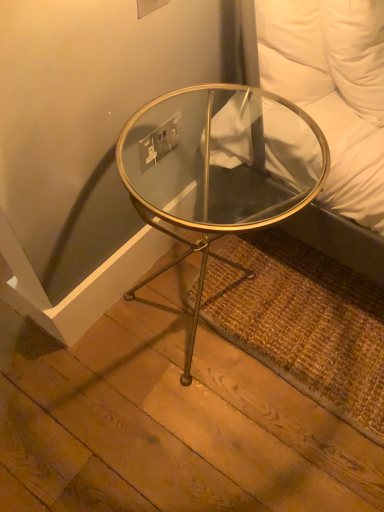
The height and width of the screenshot is (512, 384). I want to click on vacant space underneath clear glass table at center (from a real-world perspective), so click(200, 303).